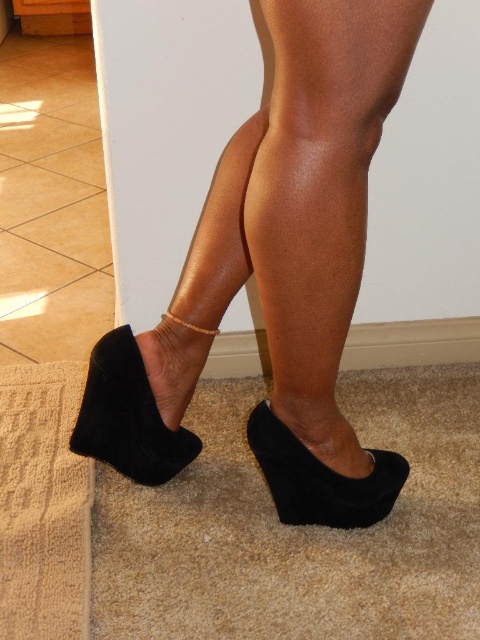
Question: Can you confirm if suede black wedge at center is positioned below suede wedge at center?

Choices:
 (A) yes
 (B) no

Answer: (B)

Question: Which of the following is the farthest from the observer?

Choices:
 (A) suede black wedge at center
 (B) matte black wedge at lower left

Answer: (B)

Question: Which object is farther from the camera taking this photo?

Choices:
 (A) suede black wedge at center
 (B) suede wedge shoe at lower left

Answer: (B)

Question: Can you confirm if matte black wedge at lower left is smaller than suede wedge shoe at lower left?

Choices:
 (A) yes
 (B) no

Answer: (B)

Question: Based on their relative distances, which object is farther from the matte black wedge at lower left?

Choices:
 (A) suede black wedge at center
 (B) suede wedge at center

Answer: (B)

Question: Is matte black wedge at lower left in front of suede wedge at center?

Choices:
 (A) yes
 (B) no

Answer: (B)